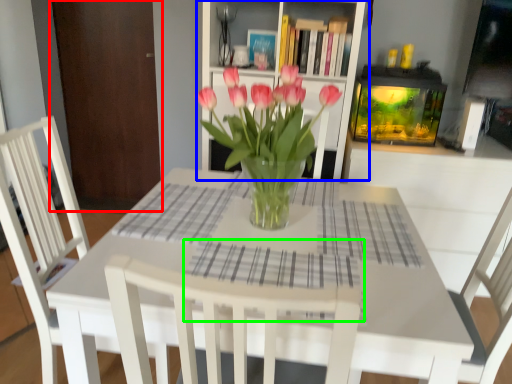
Question: Which object is positioned farthest from armoire (highlighted by a red box)? Select from shelf (highlighted by a blue box) and plaid (highlighted by a green box).

Choices:
 (A) shelf
 (B) plaid

Answer: (B)